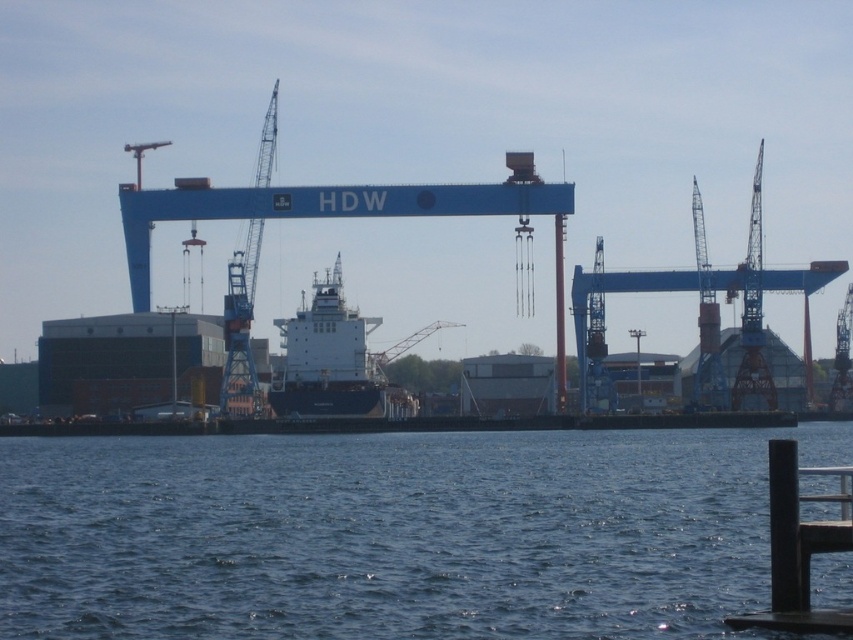
Question: Which of the following is the farthest from the observer?

Choices:
 (A) (785, 609)
 (B) (334, 296)
 (C) (723, 538)

Answer: (B)

Question: Is black metal dock at lower right smaller than blue metallic crane at center?

Choices:
 (A) no
 (B) yes

Answer: (A)

Question: Which point is farther from the camera taking this photo?

Choices:
 (A) (471, 614)
 (B) (373, 385)
 (C) (380, 353)

Answer: (C)

Question: Among these objects, which one is farthest from the camera?

Choices:
 (A) white matte ship at center
 (B) black metal dock at lower right
 (C) blue water at lower center

Answer: (A)

Question: Can you confirm if blue water at lower center is positioned above blue metallic crane at center?

Choices:
 (A) yes
 (B) no

Answer: (B)

Question: Is white matte ship at center to the right of blue metallic crane at center from the viewer's perspective?

Choices:
 (A) yes
 (B) no

Answer: (B)